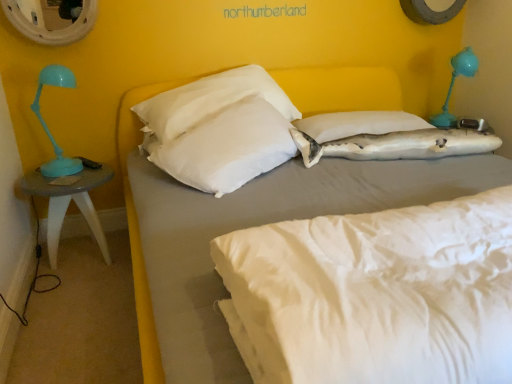
Question: Considering the relative positions of white fabric shark at center, which is the 1th pillow in right-to-left order, and metallic circular mirror at upper left in the image provided, is white fabric shark at center, which is the 1th pillow in right-to-left order, in front of metallic circular mirror at upper left?

Choices:
 (A) no
 (B) yes

Answer: (B)

Question: Can we say white fabric shark at center, which is the 1th pillow in right-to-left order, lies outside metallic circular mirror at upper left?

Choices:
 (A) yes
 (B) no

Answer: (A)

Question: Is white fabric shark at center, marked as the third pillow in a left-to-right arrangement, thinner than metallic circular mirror at upper left?

Choices:
 (A) no
 (B) yes

Answer: (A)

Question: Is white fabric shark at center, which is the 1th pillow in right-to-left order, behind metallic circular mirror at upper left?

Choices:
 (A) no
 (B) yes

Answer: (A)

Question: Is white fabric shark at center, which is the 1th pillow in right-to-left order, facing away from metallic circular mirror at upper left?

Choices:
 (A) no
 (B) yes

Answer: (A)

Question: Relative to white matte bed at center, is white soft pillow at center, the 1th pillow in the left-to-right sequence, in front or behind?

Choices:
 (A) front
 (B) behind

Answer: (B)

Question: Is white soft pillow at center, which is the third pillow from right to left, taller or shorter than white matte bed at center?

Choices:
 (A) tall
 (B) short

Answer: (B)

Question: Does point (280, 135) appear closer or farther from the camera than point (355, 94)?

Choices:
 (A) farther
 (B) closer

Answer: (B)

Question: Looking at their shapes, would you say white soft pillow at center, the 1th pillow in the left-to-right sequence, is wider or thinner than white matte bed at center?

Choices:
 (A) thin
 (B) wide

Answer: (A)

Question: Is matte gray table at left taller or shorter than white matte bed at center?

Choices:
 (A) tall
 (B) short

Answer: (B)

Question: Is matte gray table at left bigger or smaller than white matte bed at center?

Choices:
 (A) big
 (B) small

Answer: (B)

Question: Is matte gray table at left spatially inside white matte bed at center, or outside of it?

Choices:
 (A) outside
 (B) inside

Answer: (A)

Question: Is matte gray table at left in front of or behind white matte bed at center in the image?

Choices:
 (A) behind
 (B) front

Answer: (A)

Question: Is point (295, 120) closer or farther from the camera than point (41, 1)?

Choices:
 (A) farther
 (B) closer

Answer: (A)

Question: Considering their positions, is white fabric pillow at center, the 2th pillow viewed from the right, located in front of or behind metallic circular mirror at upper left?

Choices:
 (A) behind
 (B) front

Answer: (A)